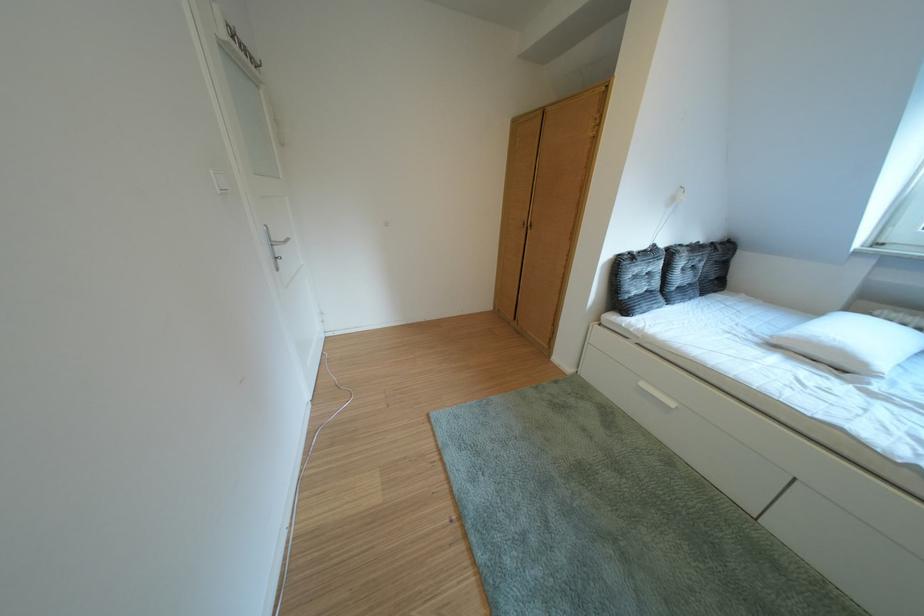
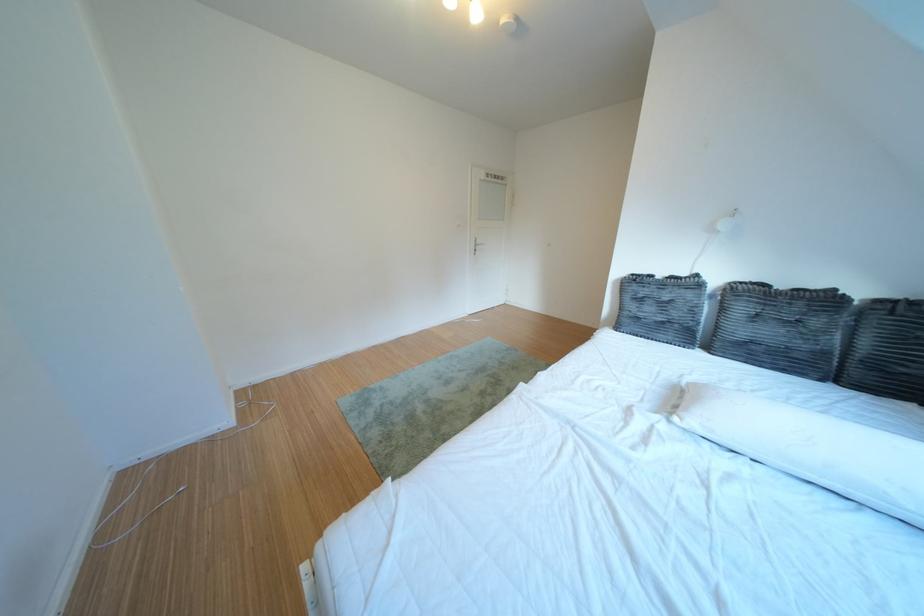
Find the pixel in the second image that matches pixel 640 301 in the first image.

(639, 318)